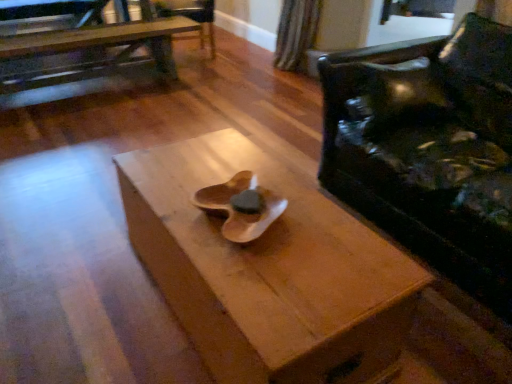
At what (x,y) coordinates should I click in order to perform the action: click on vacant space to the right of wooden table at upper left, placed as the second table when sorted from front to back. Please return your answer as a coordinate pair (x, y). Looking at the image, I should click on point(213,91).